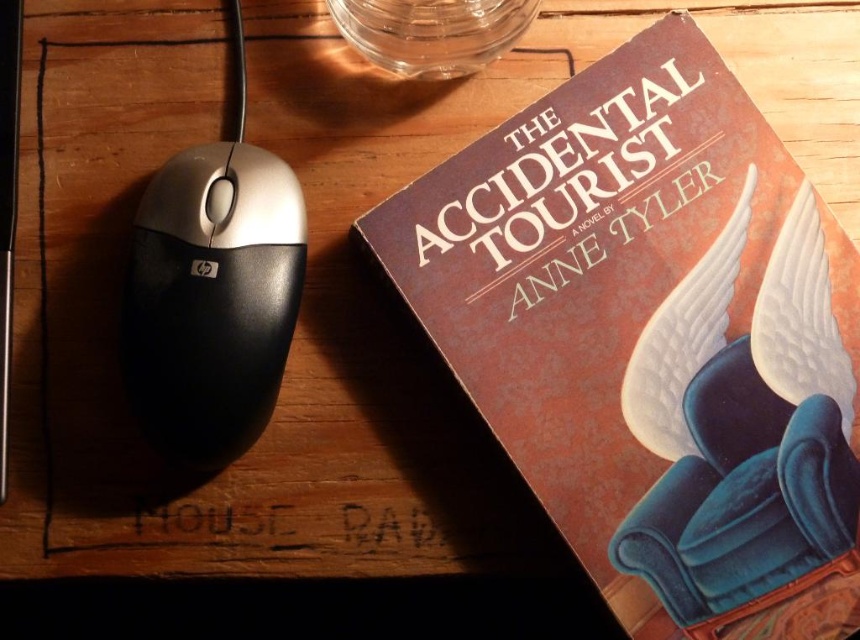
Does black plastic mouse at left lie behind blue velvet armchair at upper right?

No, black plastic mouse at left is closer to the viewer.

Identify the location of black plastic mouse at left. (212, 298).

Find the location of a particular element. The image size is (860, 640). black plastic mouse at left is located at coordinates (212, 298).

Is point (680, 420) closer to viewer compared to point (478, 12)?

Yes, point (680, 420) is in front of point (478, 12).

The height and width of the screenshot is (640, 860). Find the location of `matte brown paper at upper right`. matte brown paper at upper right is located at coordinates (630, 291).

Can you confirm if black plastic mouse at left is taller than transparent glass bowl at upper center?

Indeed, black plastic mouse at left has a greater height compared to transparent glass bowl at upper center.

Where is `black plastic mouse at left`? The width and height of the screenshot is (860, 640). black plastic mouse at left is located at coordinates (212, 298).

In order to click on black plastic mouse at left in this screenshot , I will do `click(212, 298)`.